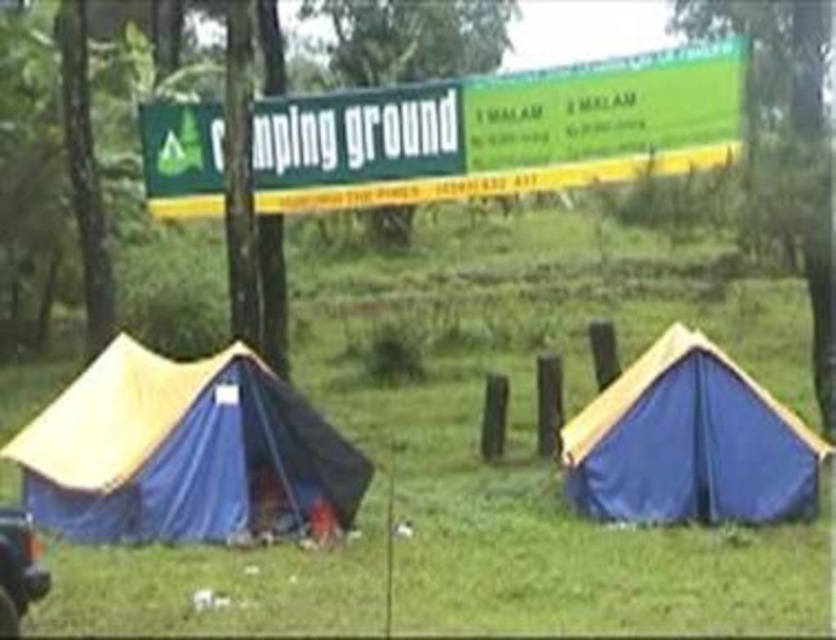
Does blue canvas tent at center have a greater height compared to shiny black car at lower left?

Yes.

Which is below, blue canvas tent at center or shiny black car at lower left?

shiny black car at lower left is below.

Is point (674, 397) less distant than point (4, 579)?

No, (674, 397) is further to viewer.

Identify the location of blue canvas tent at center. Image resolution: width=836 pixels, height=640 pixels. (689, 442).

Is green grass at center below blue canvas tent at center?

No.

Which of these two, green grass at center or blue canvas tent at center, stands taller?

With more height is green grass at center.

Is point (828, 618) behind point (679, 353)?

No, (828, 618) is closer to viewer.

This screenshot has width=836, height=640. Identify the location of green grass at center. (505, 445).

Which is in front, point (520, 236) or point (247, 390)?

Point (247, 390) is more forward.

Does green grass at center appear under blue fabric tent at left?

No, green grass at center is not below blue fabric tent at left.

Is point (513, 227) farther from viewer compared to point (325, 426)?

Yes, it is.

Where is `green grass at center`? green grass at center is located at coordinates (505, 445).